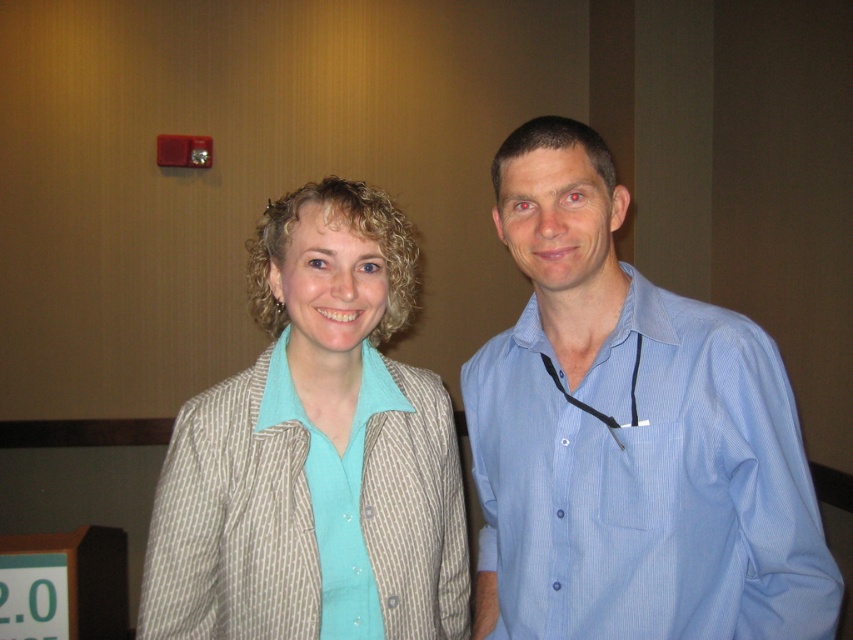
You are organizing a clothing donation drive and need to categorize items by size. You have a blue striped shirt at right and a light brown textured blazer at center. Which item should you place in the large size bin?

The blue striped shirt at right is larger in size than the light brown textured blazer at center, so it should be placed in the large size bin.

You are a photographer at an event and want to adjust your camera to focus on the blue striped shirt at right without the light brown textured blazer at center overlapping it. Is this possible based on their current positions?

The blue striped shirt at right is in front of the light brown textured blazer at center, so yes, you can focus on the blue striped shirt at right without the light brown textured blazer at center overlapping it.

Based on the scene description, can you determine the relative positions of the blue striped shirt at right and the light brown textured blazer at center from the perspective of someone facing the image?

The blue striped shirt at right is positioned to the right of the light brown textured blazer at center, so from the viewer facing the image, the blue striped shirt at right is on the right side while the light brown textured blazer at center is in the middle.